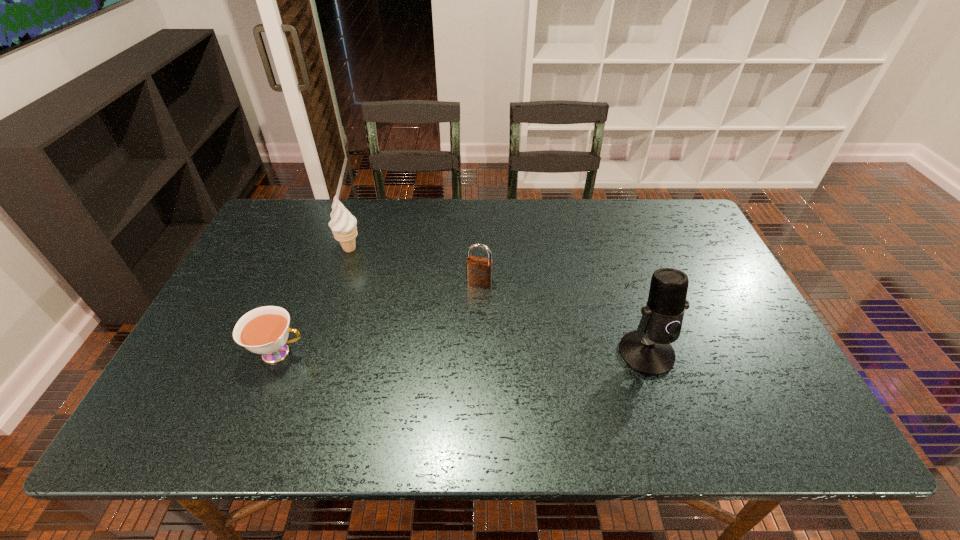
Locate an element on the screen. The height and width of the screenshot is (540, 960). blank space located on the front-facing side of the padlock is located at coordinates (460, 346).

The height and width of the screenshot is (540, 960). What are the coordinates of `vacant space located 0.220m on the front-facing side of the padlock` in the screenshot? It's located at (459, 350).

Where is `vacant area situated 0.220m on the front-facing side of the icecream`? The image size is (960, 540). vacant area situated 0.220m on the front-facing side of the icecream is located at coordinates 393,298.

The width and height of the screenshot is (960, 540). I want to click on free point located on the front-facing side of the icecream, so [370, 272].

Identify the location of free region located on the front-facing side of the icecream. (410, 317).

Where is `object located in the far edge section of the desktop`? The height and width of the screenshot is (540, 960). object located in the far edge section of the desktop is located at coordinates (343, 224).

The height and width of the screenshot is (540, 960). I want to click on teacup located at the near edge, so click(264, 330).

The image size is (960, 540). In order to click on microphone that is at the near edge in this screenshot , I will do `click(647, 350)`.

Locate an element on the screen. The image size is (960, 540). object located in the left edge section of the desktop is located at coordinates (264, 330).

This screenshot has width=960, height=540. Find the location of `object that is at the near left corner`. object that is at the near left corner is located at coordinates (264, 330).